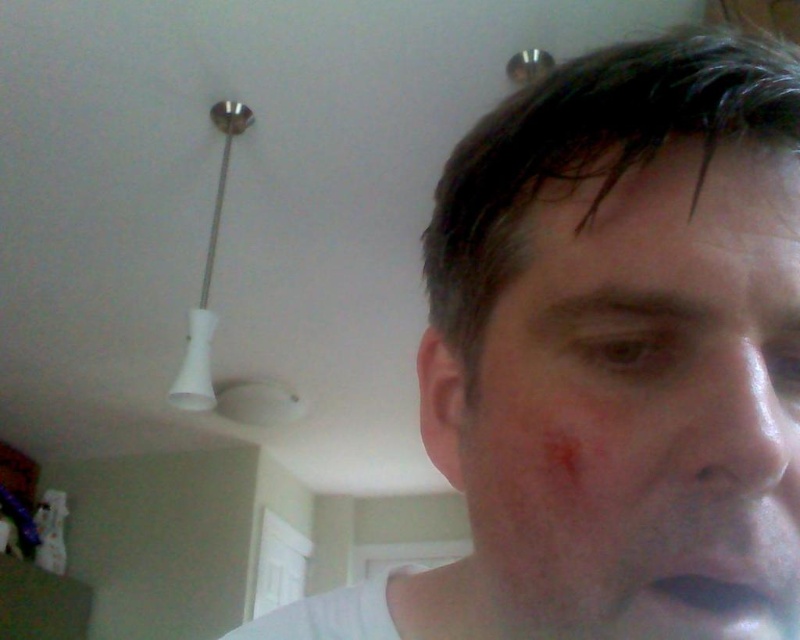
You are a skincare specialist examining a patient. You notice two areas of concern on their face. The first is the matte white face at upper right, and the second is the dry skin at upper center. Based on their proximity, can you determine if these two areas are close enough to require a combined treatment approach?

The distance between the matte white face at upper right and the dry skin at upper center is 3.32 inches, which is relatively close. Depending on the treatment method, these areas may be treated together. However, the specific treatment approach should consider both the type of skin concerns and their locations.

You are a photographer adjusting the lighting in a studio. You need to ensure that the matte white face at upper right, represented by point (604, 342), is properly lit. Where should you position the light source relative to the point to avoid harsh shadows?

The matte white face at upper right is represented by point (604, 342). To avoid harsh shadows, the light source should be positioned directly above the point to ensure even illumination.

Looking at this image, you are a dermatologist examining a patient. You notice two features on their face. The first is a smooth skin scar at center, and the second is matte white lips at lower right. Based on their positions, which one is closer to the patient forehead?

The smooth skin scar at center is closer to the patient forehead because it is located above the matte white lips at lower right.